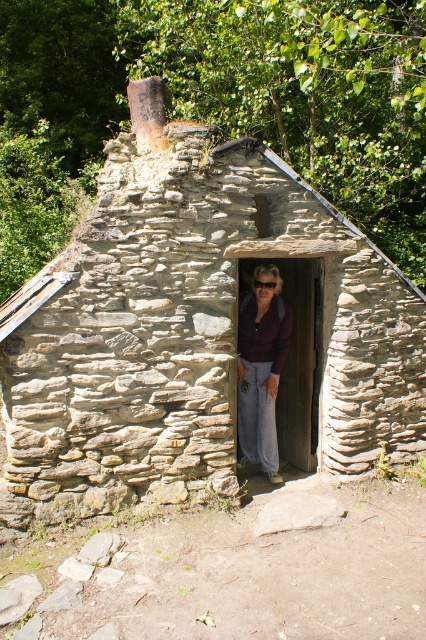
Question: Among these objects, which one is nearest to the camera?

Choices:
 (A) matte purple shirt at center
 (B) rustic stone cabin at center

Answer: (B)

Question: Can you confirm if rustic stone cabin at center is positioned to the left of matte purple shirt at center?

Choices:
 (A) yes
 (B) no

Answer: (A)

Question: Which object appears farthest from the camera in this image?

Choices:
 (A) rustic stone cabin at center
 (B) matte purple shirt at center

Answer: (B)

Question: Is rustic stone cabin at center closer to camera compared to matte purple shirt at center?

Choices:
 (A) no
 (B) yes

Answer: (B)

Question: In this image, where is rustic stone cabin at center located relative to matte purple shirt at center?

Choices:
 (A) below
 (B) above

Answer: (B)

Question: Which of the following is the farthest from the observer?

Choices:
 (A) (178, 316)
 (B) (287, 330)

Answer: (B)